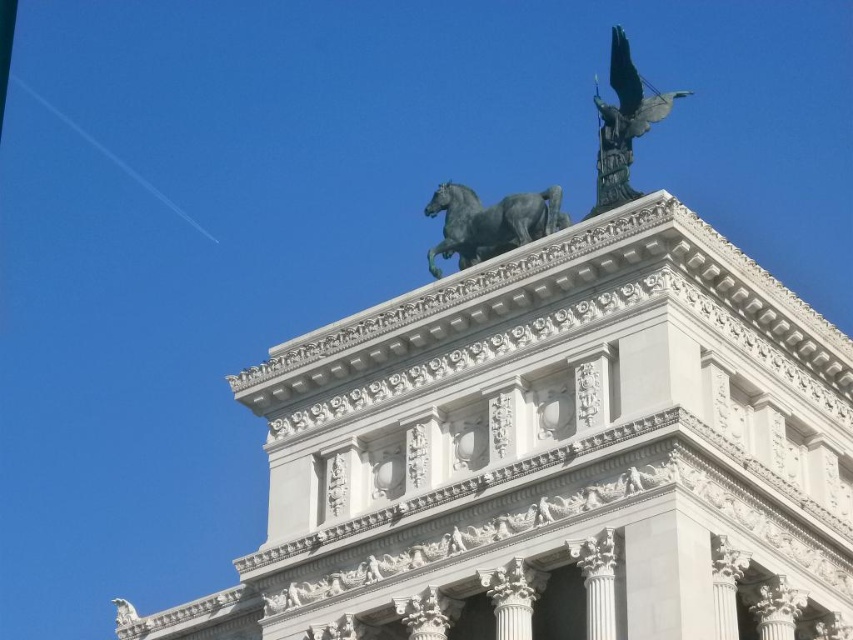
Between green polished stone tower at upper center and shiny black horse at top center, which one is positioned higher?

Positioned higher is shiny black horse at top center.

The width and height of the screenshot is (853, 640). What are the coordinates of `green polished stone tower at upper center` in the screenshot? It's located at (554, 454).

In the scene shown: Which is more to the left, shiny black horse at top center or green patina eagle at upper center?

shiny black horse at top center is more to the left.

Which is more to the right, shiny black horse at top center or green patina eagle at upper center?

green patina eagle at upper center

The width and height of the screenshot is (853, 640). What are the coordinates of `shiny black horse at top center` in the screenshot? It's located at (490, 221).

Between green polished stone tower at upper center and green patina eagle at upper center, which one is positioned lower?

green polished stone tower at upper center

Is green polished stone tower at upper center to the left of green patina eagle at upper center from the viewer's perspective?

Correct, you'll find green polished stone tower at upper center to the left of green patina eagle at upper center.

Is point (381, 540) farther from viewer compared to point (642, 106)?

No, it is not.

The width and height of the screenshot is (853, 640). Identify the location of green polished stone tower at upper center. (554, 454).